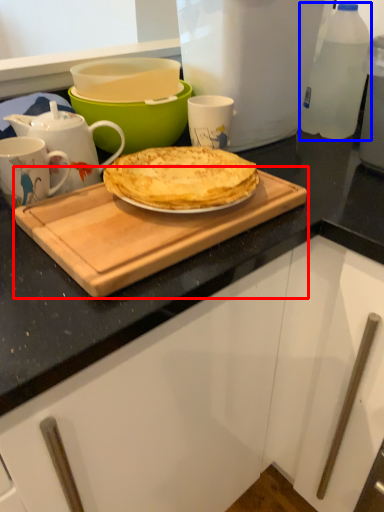
Question: Which object appears farthest to the camera in this image, cutting board (highlighted by a red box) or bottle (highlighted by a blue box)?

Choices:
 (A) cutting board
 (B) bottle

Answer: (B)